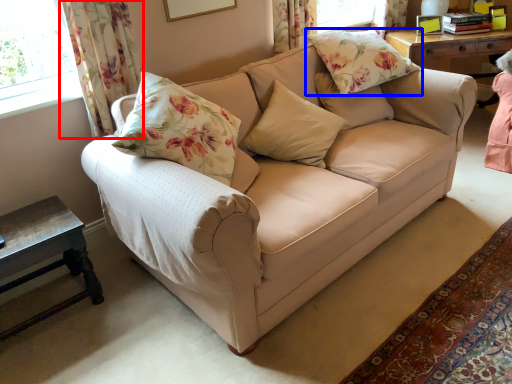
Question: Among these objects, which one is nearest to the camera, curtain (highlighted by a red box) or pillow (highlighted by a blue box)?

Choices:
 (A) curtain
 (B) pillow

Answer: (A)